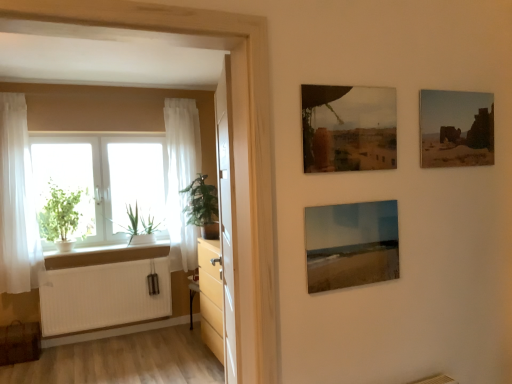
Question: Does green leafy plant at left have a greater width compared to white glass window at left?

Choices:
 (A) yes
 (B) no

Answer: (A)

Question: Considering the relative sizes of green leafy plant at left and white glass window at left in the image provided, is green leafy plant at left thinner than white glass window at left?

Choices:
 (A) no
 (B) yes

Answer: (A)

Question: Is green leafy plant at left positioned far away from white glass window at left?

Choices:
 (A) no
 (B) yes

Answer: (A)

Question: Would you say white glass window at left is part of green leafy plant at left's contents?

Choices:
 (A) yes
 (B) no

Answer: (B)

Question: Is green leafy plant at left further to camera compared to white glass window at left?

Choices:
 (A) yes
 (B) no

Answer: (A)

Question: Is point (32, 221) closer or farther from the camera than point (179, 142)?

Choices:
 (A) farther
 (B) closer

Answer: (B)

Question: From a real-world perspective, is white sheer curtain at left, acting as the 2th curtain starting from the right, positioned above or below white sheer curtain at left, the second curtain when ordered from front to back?

Choices:
 (A) below
 (B) above

Answer: (B)

Question: From the image's perspective, relative to white sheer curtain at left, positioned as the second curtain in left-to-right order, is white sheer curtain at left, the first curtain positioned from the front, above or below?

Choices:
 (A) above
 (B) below

Answer: (B)

Question: Is white sheer curtain at left, acting as the 2th curtain starting from the right, wider or thinner than white sheer curtain at left, placed as the first curtain when sorted from back to front?

Choices:
 (A) wide
 (B) thin

Answer: (B)

Question: Would you say green matte plant at left, arranged as the first houseplant when viewed from the left, is to the left or to the right of green leafy plant at left, placed as the second houseplant when sorted from left to right, in the picture?

Choices:
 (A) right
 (B) left

Answer: (B)

Question: In the image, is green matte plant at left, arranged as the first houseplant when viewed from the left, positioned in front of or behind green leafy plant at left, marked as the first houseplant in a right-to-left arrangement?

Choices:
 (A) behind
 (B) front

Answer: (A)

Question: Looking at the image, does green matte plant at left, arranged as the first houseplant when viewed from the left, seem bigger or smaller compared to green leafy plant at left, marked as the first houseplant in a right-to-left arrangement?

Choices:
 (A) small
 (B) big

Answer: (B)

Question: From the image's perspective, is green matte plant at left, arranged as the first houseplant when viewed from the left, located above or below green leafy plant at left, marked as the first houseplant in a right-to-left arrangement?

Choices:
 (A) below
 (B) above

Answer: (A)

Question: Is green leafy plant at left, placed as the second houseplant when sorted from left to right, to the left or to the right of white ribbed radiator at lower left in the image?

Choices:
 (A) right
 (B) left

Answer: (A)

Question: In the image, is green leafy plant at left, placed as the second houseplant when sorted from left to right, positioned in front of or behind white ribbed radiator at lower left?

Choices:
 (A) behind
 (B) front

Answer: (B)